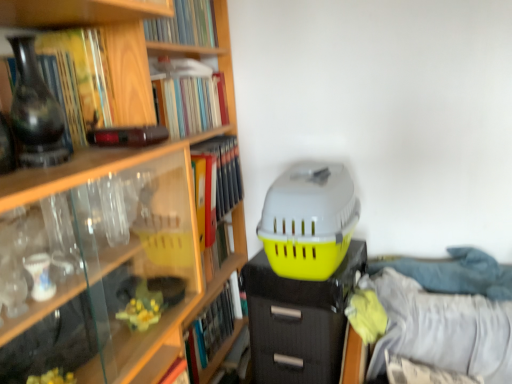
Question: Is yellow matte file folder at upper center, placed as the 4th book when sorted from top to bottom, positioned before matte black file cabinet at center?

Choices:
 (A) yes
 (B) no

Answer: (B)

Question: Is matte black file cabinet at center at the back of yellow matte file folder at upper center, placed as the 4th book when sorted from top to bottom?

Choices:
 (A) no
 (B) yes

Answer: (A)

Question: From a real-world perspective, is yellow matte file folder at upper center, placed as the 4th book when sorted from top to bottom, on top of matte black file cabinet at center?

Choices:
 (A) yes
 (B) no

Answer: (A)

Question: Considering the relative sizes of yellow matte file folder at upper center, placed as the 4th book when sorted from top to bottom, and matte black file cabinet at center in the image provided, is yellow matte file folder at upper center, placed as the 4th book when sorted from top to bottom, shorter than matte black file cabinet at center?

Choices:
 (A) yes
 (B) no

Answer: (A)

Question: Is yellow matte file folder at upper center, placed as the 4th book when sorted from top to bottom, wider than matte black file cabinet at center?

Choices:
 (A) no
 (B) yes

Answer: (A)

Question: Does yellow matte file folder at upper center, acting as the 3th book starting from the bottom, have a smaller size compared to matte black file cabinet at center?

Choices:
 (A) no
 (B) yes

Answer: (B)

Question: From a real-world perspective, is matte black vase at left under matte black file cabinet at center?

Choices:
 (A) yes
 (B) no

Answer: (B)

Question: Is matte black vase at left to the right of matte black file cabinet at center from the viewer's perspective?

Choices:
 (A) no
 (B) yes

Answer: (A)

Question: Does matte black vase at left have a larger size compared to matte black file cabinet at center?

Choices:
 (A) no
 (B) yes

Answer: (A)

Question: Considering the relative sizes of matte black vase at left and matte black file cabinet at center in the image provided, is matte black vase at left taller than matte black file cabinet at center?

Choices:
 (A) no
 (B) yes

Answer: (A)

Question: Is matte black vase at left further to camera compared to matte black file cabinet at center?

Choices:
 (A) yes
 (B) no

Answer: (B)

Question: Is matte black vase at left aimed at matte black file cabinet at center?

Choices:
 (A) yes
 (B) no

Answer: (B)

Question: Is matte black file cabinet at center next to hardcover book at lower left, which is the first book in bottom-to-top order?

Choices:
 (A) yes
 (B) no

Answer: (B)